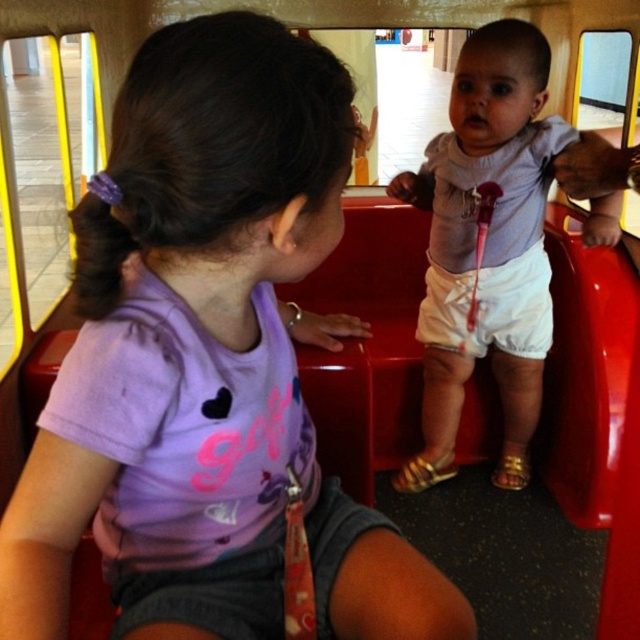
Is purple matte shirt at upper left above white cotton shorts at center?

No.

Which is more to the right, purple matte shirt at upper left or white cotton shorts at center?

white cotton shorts at center is more to the right.

Which is in front, point (161, 106) or point (545, 68)?

Point (161, 106)

Where is `purple matte shirt at upper left`? The height and width of the screenshot is (640, 640). purple matte shirt at upper left is located at coordinates (x=208, y=362).